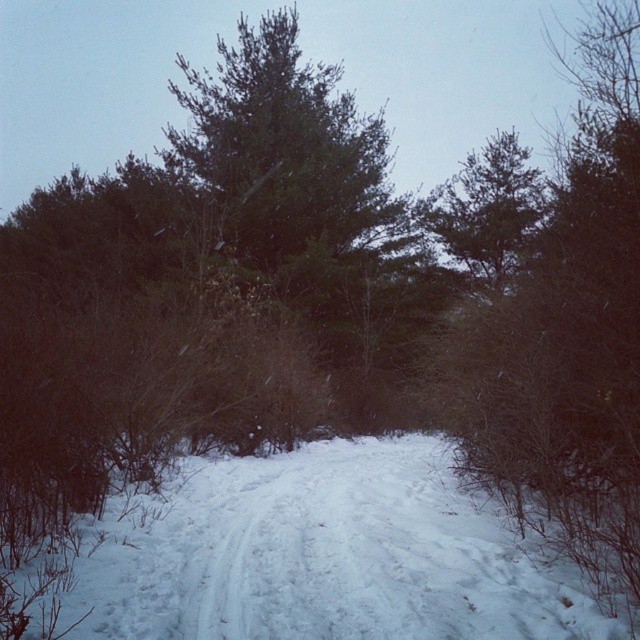
Is point (275, 620) positioned in front of point (500, 288)?

Yes, it is in front of point (500, 288).

Does white powdery snow at center come behind green needle-like at upper center?

No, white powdery snow at center is closer to the viewer.

Locate an element on the screen. The width and height of the screenshot is (640, 640). white powdery snow at center is located at coordinates (321, 556).

Identify the location of white powdery snow at center. point(321,556).